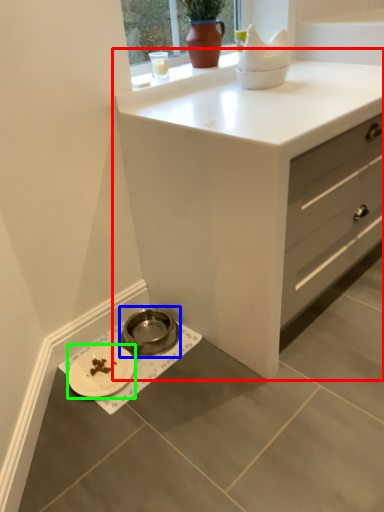
Question: Based on their relative distances, which object is farther from chest of drawers (highlighted by a red box)? Choose from appliance (highlighted by a blue box) and platter (highlighted by a green box).

Choices:
 (A) appliance
 (B) platter

Answer: (B)